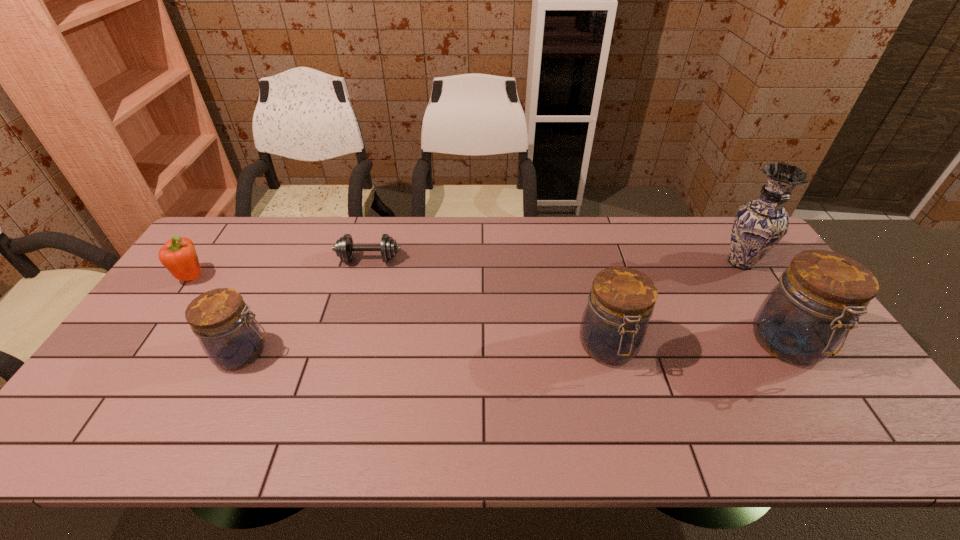
Locate an element on the screen. The image size is (960, 540). blank space located on the lid of the second tallest jar is located at coordinates (621, 393).

The width and height of the screenshot is (960, 540). What are the coordinates of `vacant area located 0.070m on the lid of the rightmost jar` in the screenshot? It's located at (826, 402).

Identify the location of vacant area situated 0.360m on the left of the vase. (606, 262).

Identify the location of blank space located 0.050m on the left of the dumbbell. The image size is (960, 540). (321, 259).

This screenshot has width=960, height=540. Find the location of `blank space located 0.210m on the back of the pepper`. blank space located 0.210m on the back of the pepper is located at coordinates (228, 227).

This screenshot has width=960, height=540. In order to click on vase present at the far edge in this screenshot , I will do `click(759, 225)`.

Where is `dumbbell that is positioned at the far edge`? Image resolution: width=960 pixels, height=540 pixels. dumbbell that is positioned at the far edge is located at coordinates (344, 248).

I want to click on object that is at the left edge, so click(x=178, y=256).

The image size is (960, 540). Identify the location of jar positioned at the right edge. (808, 314).

Where is `vase that is positioned at the right edge`? The image size is (960, 540). vase that is positioned at the right edge is located at coordinates (759, 225).